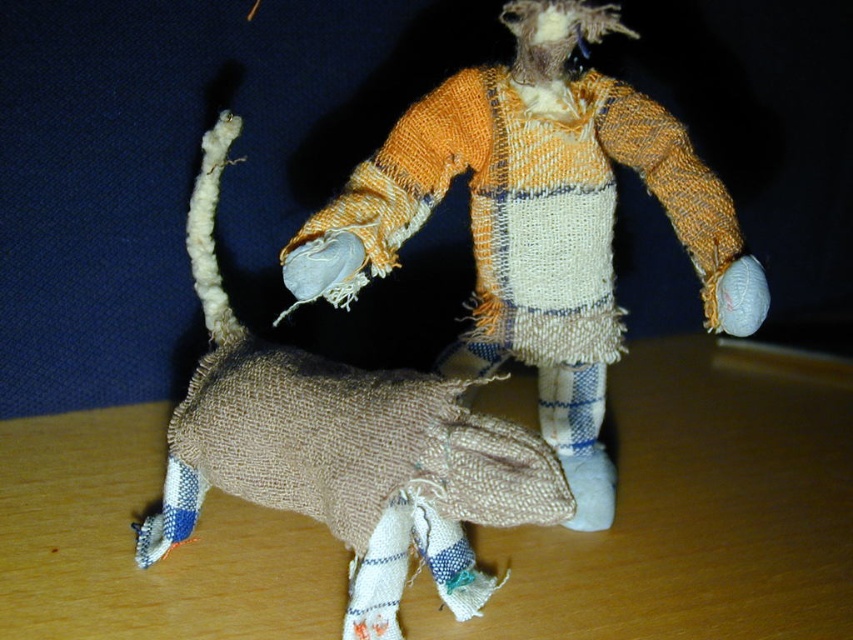
You are a photographer adjusting your camera to focus on two points in the image. The first point is point [148,445] and the second is point [639,97]. Which point should you focus on first to ensure the closest object is sharp?

Point [148,445] is further to the camera than point [639,97], so you should focus on point [148,445] first to capture the closest object sharply.

You are setting up a display for a craft fair and need to ensure that the wooden table at center can support the textured burlap scarecrow at center. Based on their sizes, will the scarecrow fit on the table without hanging over the edges?

The wooden table at center is not as tall as the textured burlap scarecrow at center, so the scarecrow may be taller than the table. However, the question is about whether it will fit without hanging over the edges, which relates to width or length, not height. Since the height of the table isn

You are a delivery robot with a 9 inch wide package. You need to place the package between the textured burlap scarecrow at center and the burlap dog at center. Is there enough space to fit the package between them?

The distance between the textured burlap scarecrow at center and the burlap dog at center is 8.44 inches. Since the package is 9 inches wide, it will not fit between them as the space is narrower than the package.